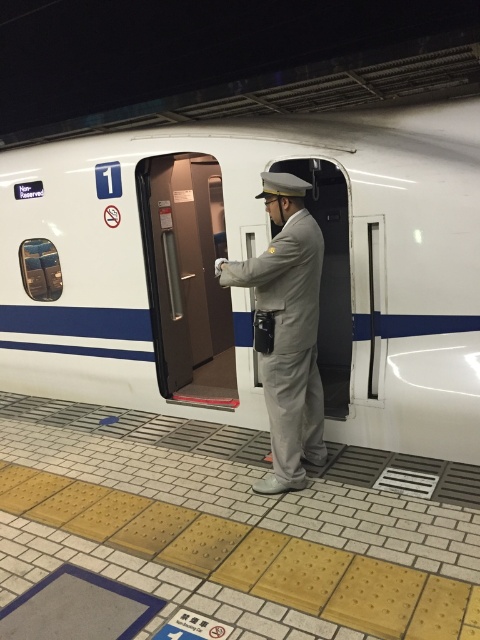
Question: Where is white glossy train at center located in relation to brown matte door at center in the image?

Choices:
 (A) below
 (B) above

Answer: (B)

Question: Which of these objects is positioned farthest from the white glossy train at center?

Choices:
 (A) gray uniform at center
 (B) brown matte door at center

Answer: (A)

Question: Is brown matte door at center further to the viewer compared to gray uniform at center?

Choices:
 (A) yes
 (B) no

Answer: (A)

Question: Among these objects, which one is nearest to the camera?

Choices:
 (A) white glossy train at center
 (B) gray uniform at center

Answer: (B)

Question: Which of the following is the farthest from the observer?

Choices:
 (A) (58, 289)
 (B) (288, 230)

Answer: (A)

Question: Is white glossy train at center thinner than gray uniform at center?

Choices:
 (A) yes
 (B) no

Answer: (B)